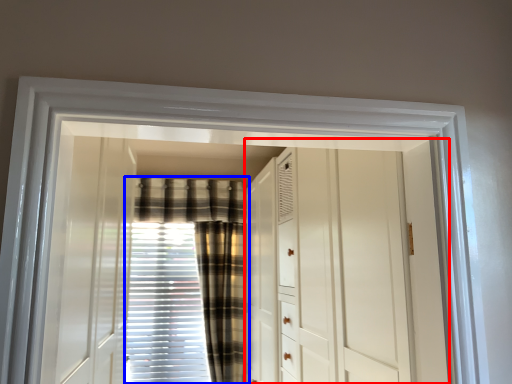
Question: Which point is further to the camera, dresser (highlighted by a red box) or curtain (highlighted by a blue box)?

Choices:
 (A) dresser
 (B) curtain

Answer: (B)